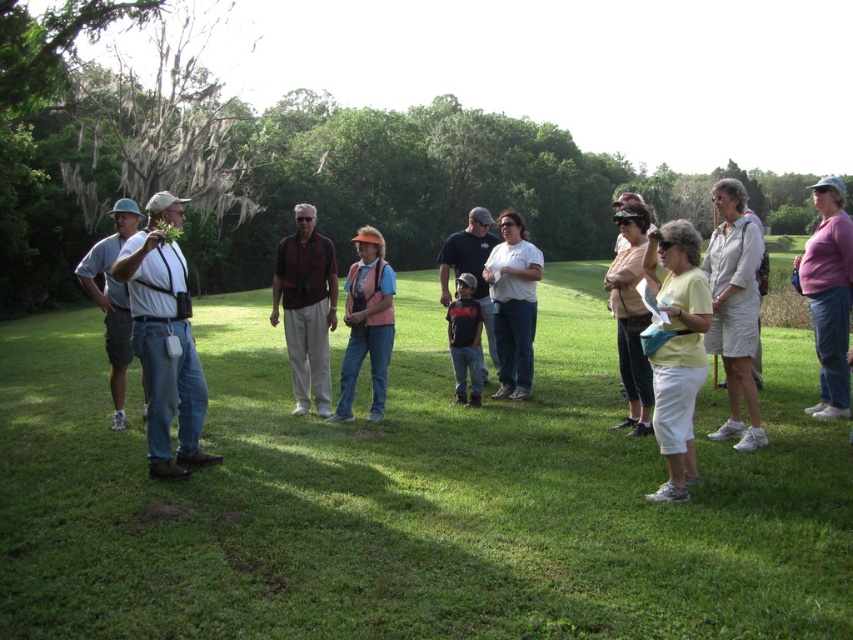
You are a photographer standing in the park and want to take a picture of the group. You notice the white cotton shorts at right and the dark blue shirt at center. Which clothing item is positioned lower in the image?

The white cotton shorts at right is below dark blue shirt at center, so the white cotton shorts at right is positioned lower in the image.

You are a photographer trying to capture a candid shot of the dark blue shirt at center and the white cotton shorts at right. Since you want to ensure both are clearly visible in the frame, which object should you focus on first considering their heights?

The white cotton shorts at right has a greater height compared to the dark blue shirt at center, so you should focus on the white cotton shorts at right first to ensure proper depth of field for both subjects.

You are a photographer trying to capture a group photo of the denim jeans at left and the white cotton shirt at center. Which clothing item should you focus on first if you want to ensure both are in frame without moving the camera?

The denim jeans at left is smaller than the white cotton shirt at center, so you should focus on the white cotton shirt at center first to ensure it fits within the frame since it takes up more space.